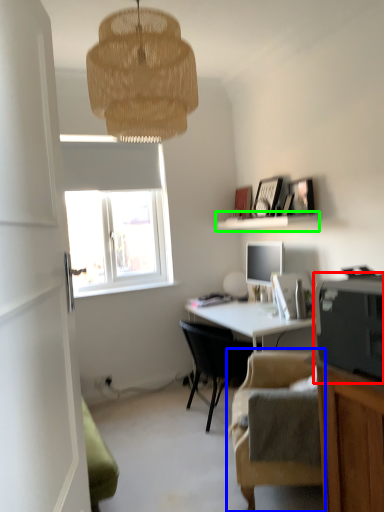
Question: Based on their relative distances, which object is farther from printer (highlighted by a red box)? Choose from chair (highlighted by a blue box) and shelf (highlighted by a green box).

Choices:
 (A) chair
 (B) shelf

Answer: (B)